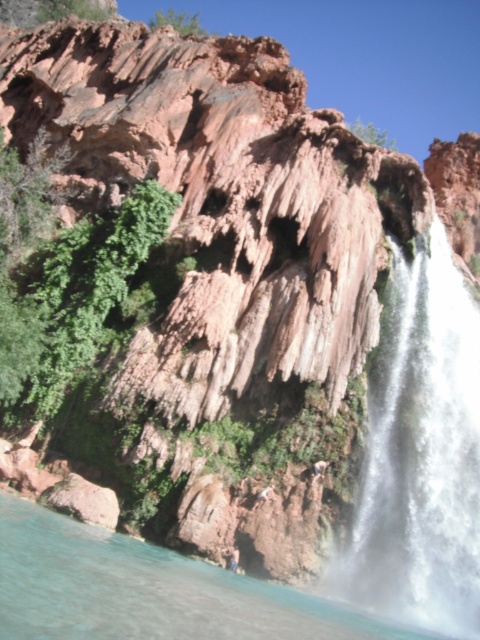
You are standing at the edge of the cliff and see the clear blue water at lower left and the light brown skin at lower center. Which one is positioned to the left?

The clear blue water at lower left is positioned to the left of the light brown skin at lower center.

You are standing at the base of the cliff and want to take a photo of the point at coordinates (237,579) on the cliff face. If your camera has a maximum zoom range of 50 meters, will you be able to capture the point clearly in your photo?

The point at coordinates (237,579) is 55.99 meters away from the camera. Since the camera can only zoom up to 50 meters, you will not be able to capture the point clearly in your photo.

From the picture: You are a hiker who wants to cross from the cliff to the water. You see the clear blue water at lower left and the light brown skin at lower center. Which one is higher up?

The clear blue water at lower left has a greater height compared to the light brown skin at lower center, so the clear blue water at lower left is higher up.